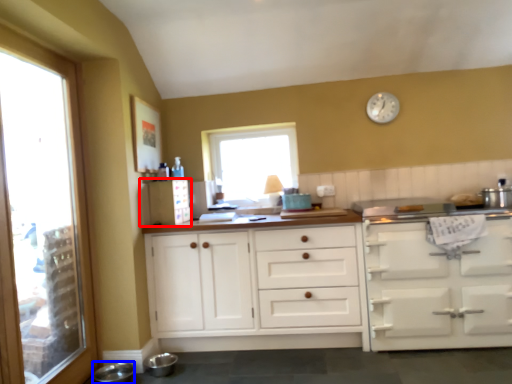
Question: Among these objects, which one is farthest to the camera, appliance (highlighted by a red box) or appliance (highlighted by a blue box)?

Choices:
 (A) appliance
 (B) appliance

Answer: (A)